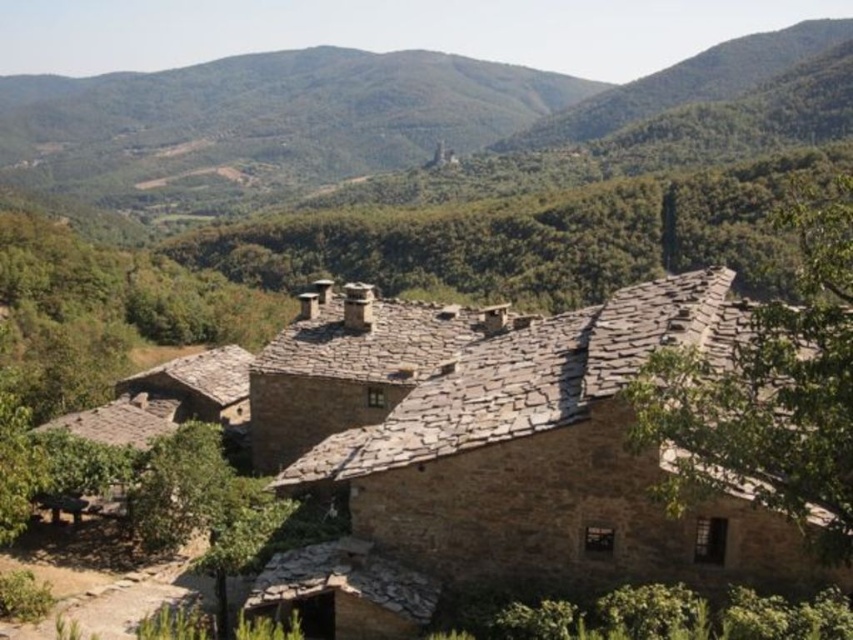
You are standing on the dirt path leading to the traditional stone building. You see the green leafy forest at upper center and the green leafy tree at lower left. Which one is closer to you?

The green leafy tree at lower left is closer to you because it is positioned nearer than the green leafy forest at upper center, which is further away.

You are standing at the starting point of the dirt path leading to the traditional stone building. You see two points marked on the path. One is at point (643, 116) and the other at point (804, 237). Which point is closer to you as you walk along the path towards the building?

Point (804, 237) is closer to you because point (643, 116) is behind it along the path.